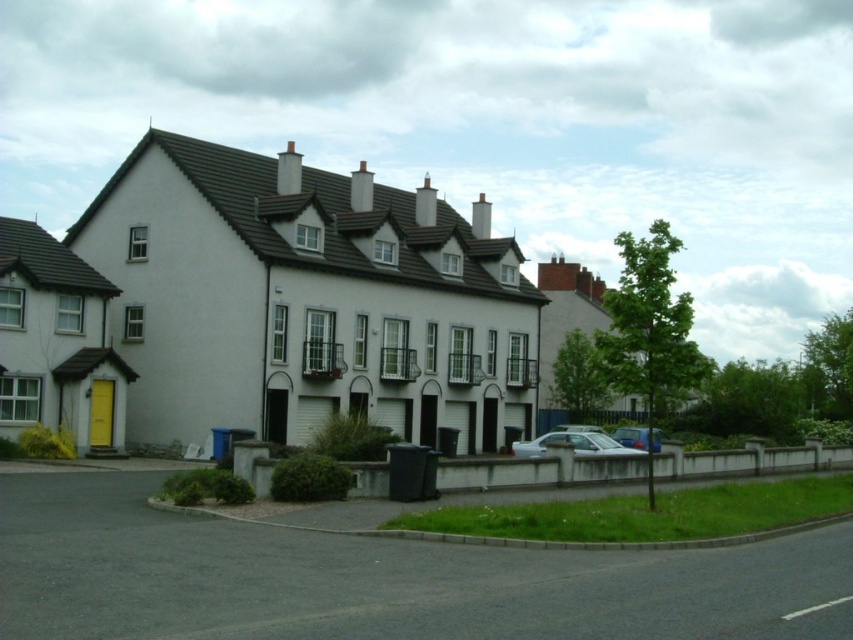
Question: Which object appears farthest from the camera in this image?

Choices:
 (A) blue metallic car at lower right
 (B) silver metallic car at center

Answer: (A)

Question: Does silver metallic car at center appear on the right side of metallic silver car at center?

Choices:
 (A) yes
 (B) no

Answer: (B)

Question: Does blue metallic car at lower right have a larger size compared to metallic silver car at center?

Choices:
 (A) yes
 (B) no

Answer: (A)

Question: Estimate the real-world distances between objects in this image. Which object is closer to the blue metallic car at lower right?

Choices:
 (A) metallic silver car at center
 (B) silver metallic car at center

Answer: (B)

Question: Is silver metallic car at center below blue metallic car at lower right?

Choices:
 (A) no
 (B) yes

Answer: (A)

Question: Considering the real-world distances, which object is closest to the metallic silver car at center?

Choices:
 (A) blue metallic car at lower right
 (B) silver metallic car at center

Answer: (A)